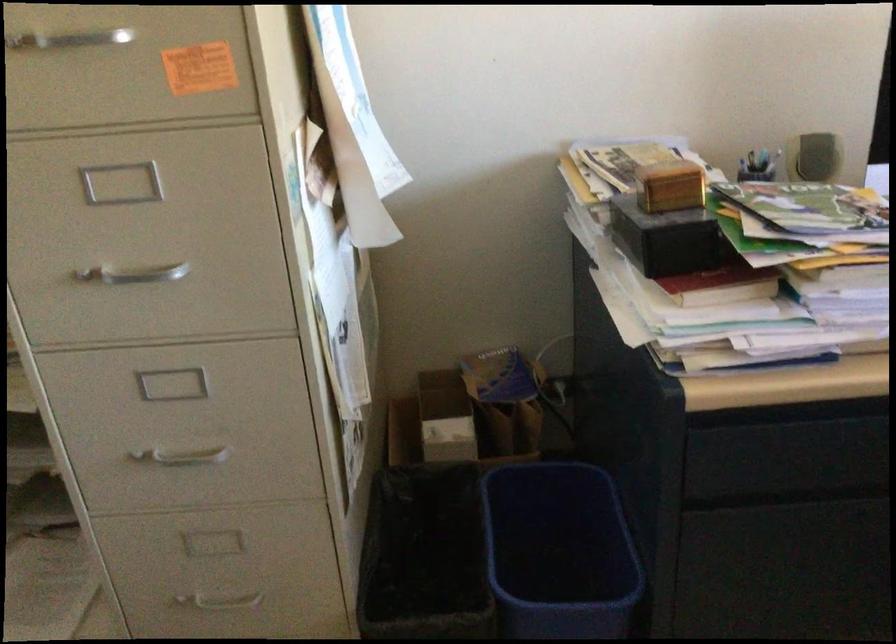
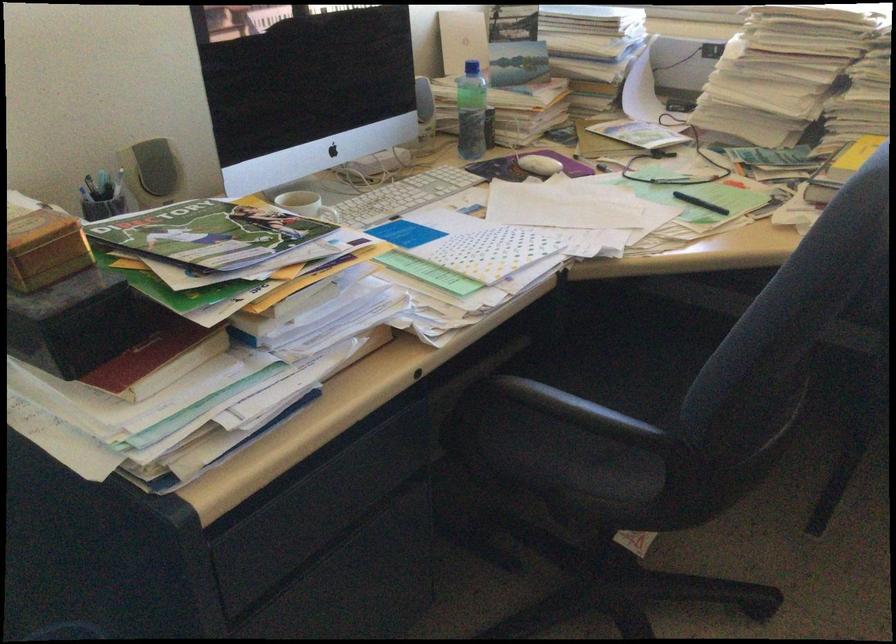
In the second image, find the point that corresponds to [784,431] in the first image.

(300, 491)